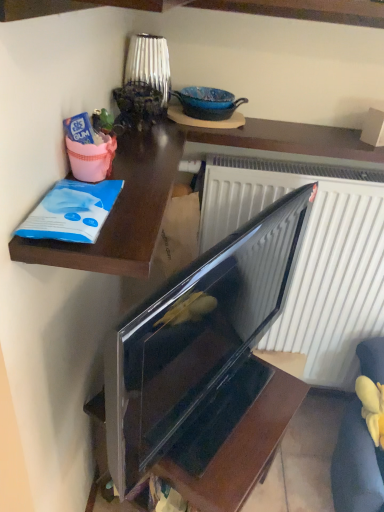
Locate an element on the screen. empty space that is ontop of glossy black tv at lower right (from a real-world perspective) is located at coordinates (233, 410).